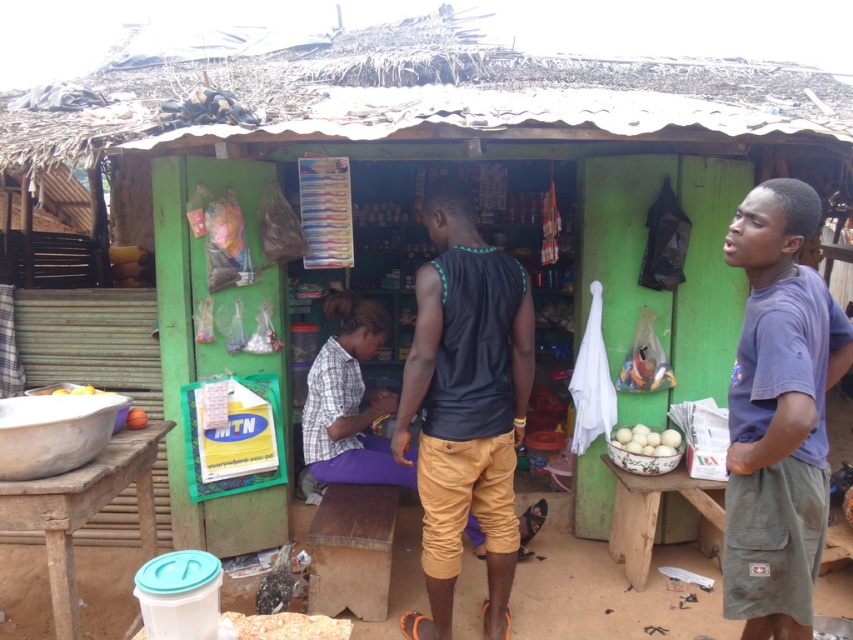
Which is behind, point (509, 323) or point (633, 436)?

Point (633, 436)

Between point (428, 262) and point (670, 442), which one is positioned in front?

Point (428, 262) is in front.

At what (x,y) coordinates should I click in order to perform the action: click on black matte tank top at center. Please return your answer as a coordinate pair (x, y). Looking at the image, I should click on (465, 406).

Can you confirm if white matte eggs at center is wider than yellow matte fruit at lower left?

Answer: In fact, white matte eggs at center might be narrower than yellow matte fruit at lower left.

Is the position of white matte eggs at center less distant than that of yellow matte fruit at lower left?

No, it is behind yellow matte fruit at lower left.

This screenshot has width=853, height=640. What are the coordinates of `white matte eggs at center` in the screenshot? It's located at (646, 440).

Can you confirm if blue cotton shirt at right is thinner than black matte tank top at center?

Correct, blue cotton shirt at right's width is less than black matte tank top at center's.

Who is more distant from viewer, [782,237] or [482,312]?

Positioned behind is point [482,312].

This screenshot has width=853, height=640. Identify the location of blue cotton shirt at right. (778, 413).